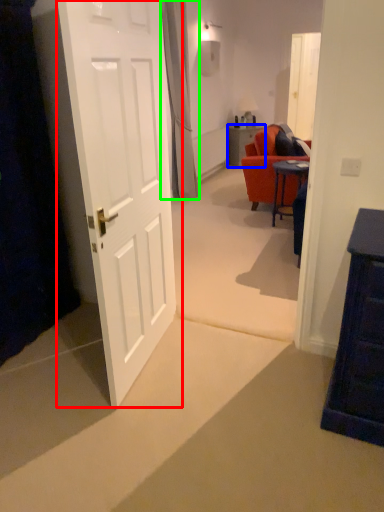
Question: Based on their relative distances, which object is nearer to door (highlighted by a red box)? Choose from table (highlighted by a blue box) and curtain (highlighted by a green box).

Choices:
 (A) table
 (B) curtain

Answer: (B)